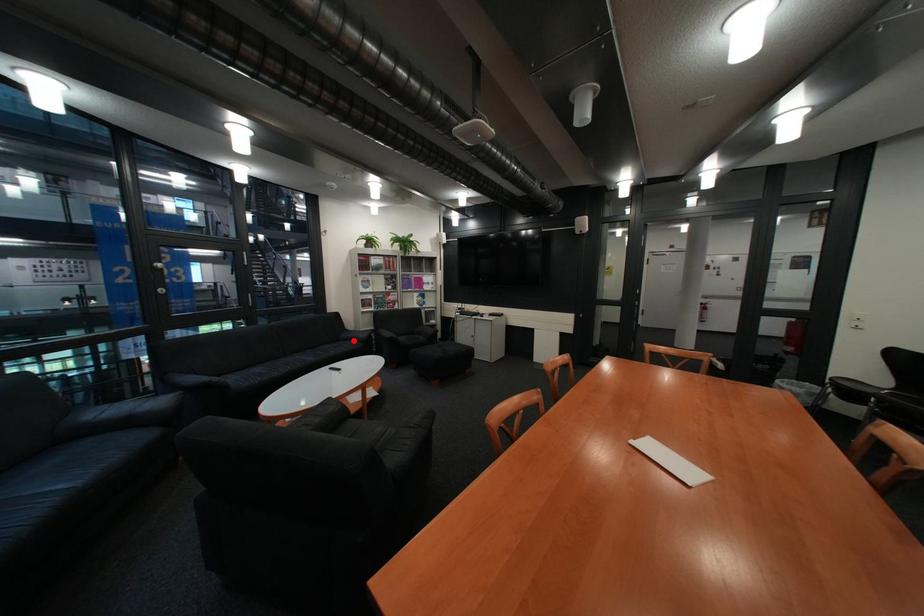
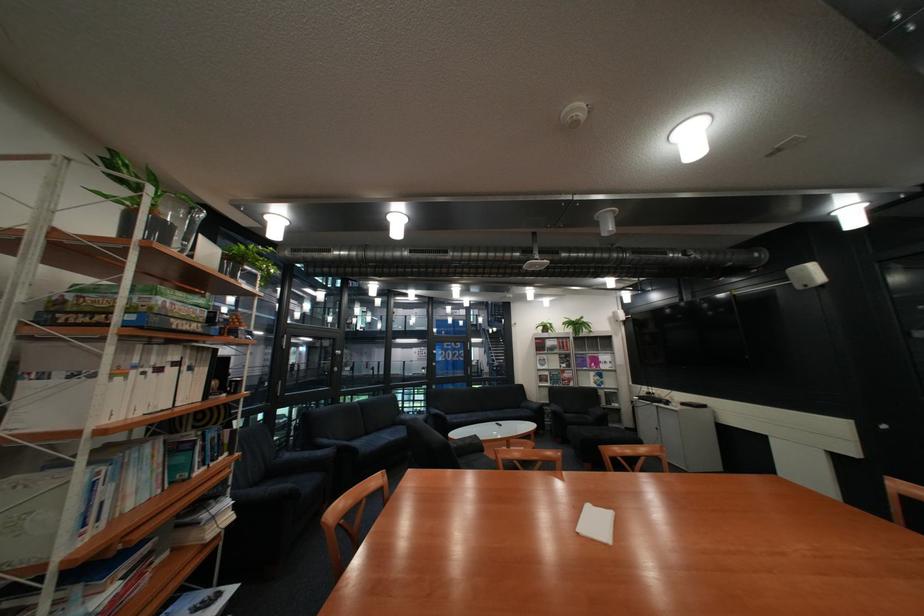
Locate, in the second image, the point that corresponds to the highlighted location in the first image.

(535, 408)